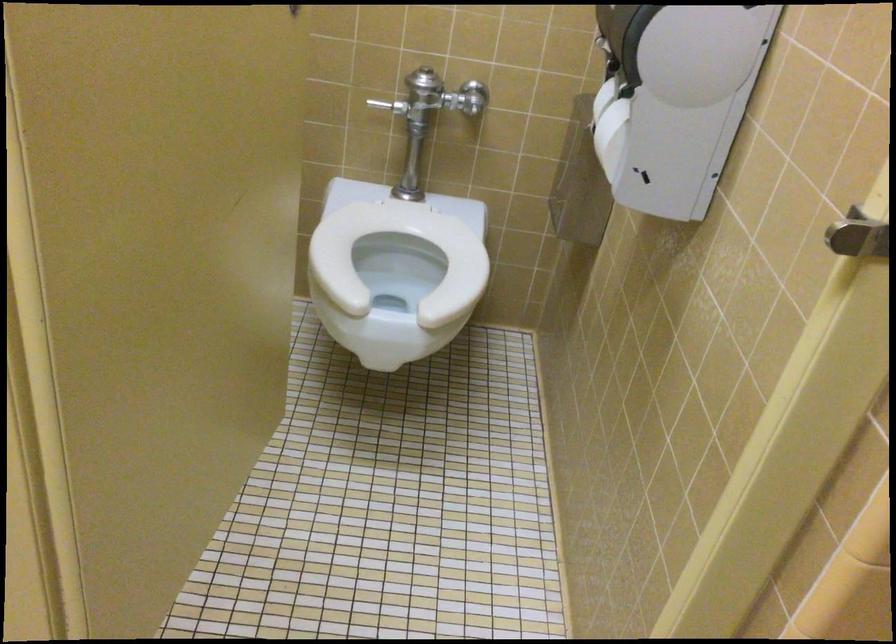
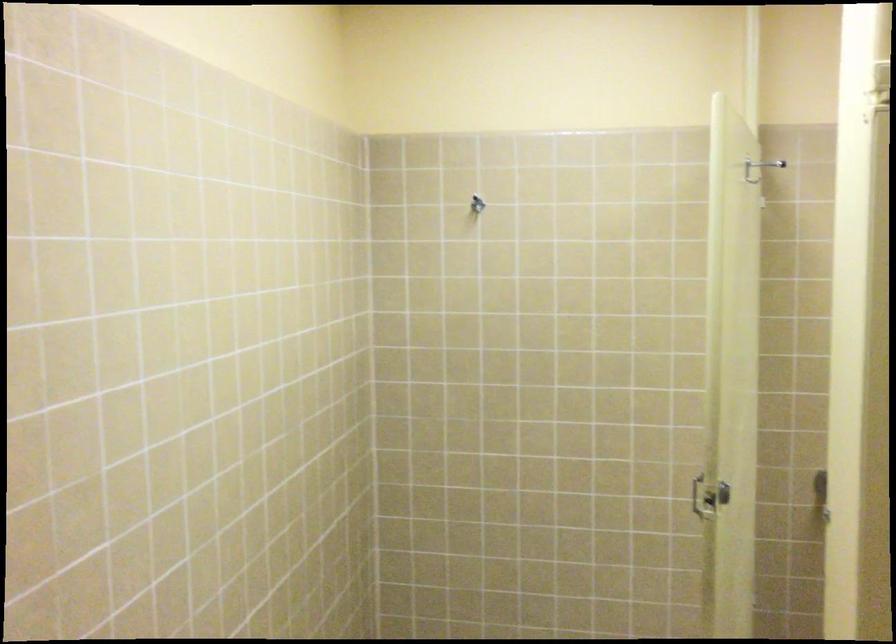
Question: The images are taken continuously from a first-person perspective. In which direction is your viewpoint rotating?

Choices:
 (A) Left
 (B) Right
 (C) Up
 (D) Down

Answer: (A)